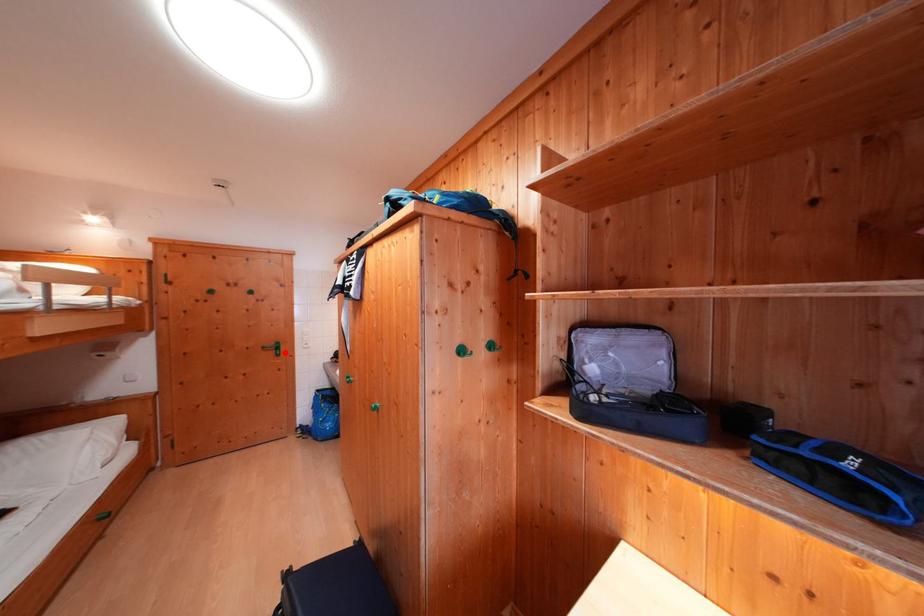
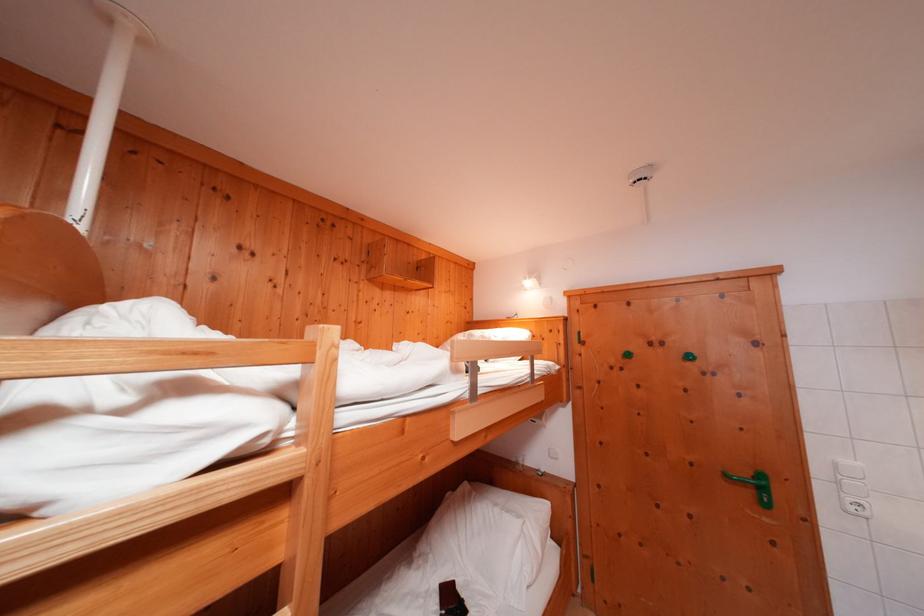
Question: I am providing you with two images of the same scene from different viewpoints. Image1 has a red point marked. In image2, the corresponding 3D location appears at what relative position? Reply with the corresponding letter.

Choices:
 (A) Closer
 (B) Farther

Answer: (A)